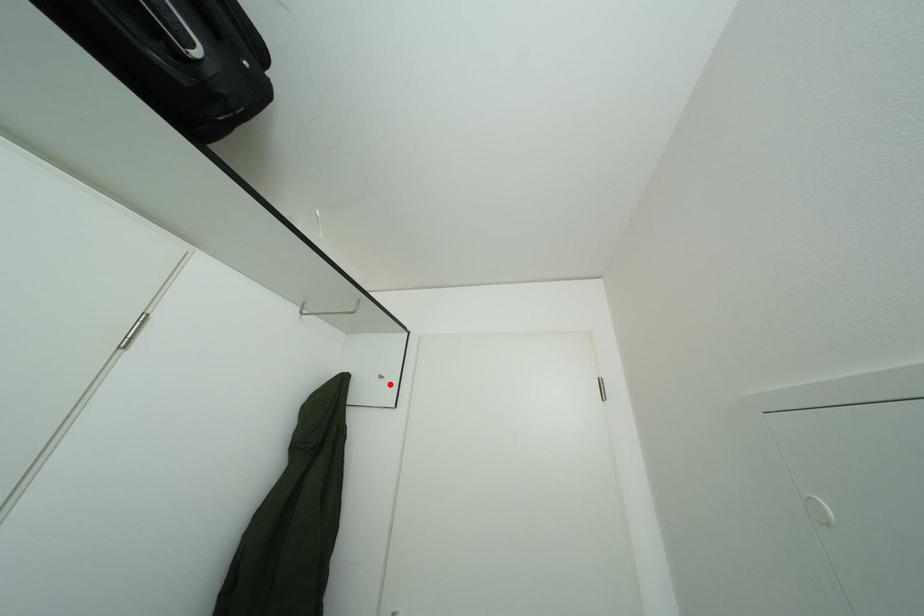
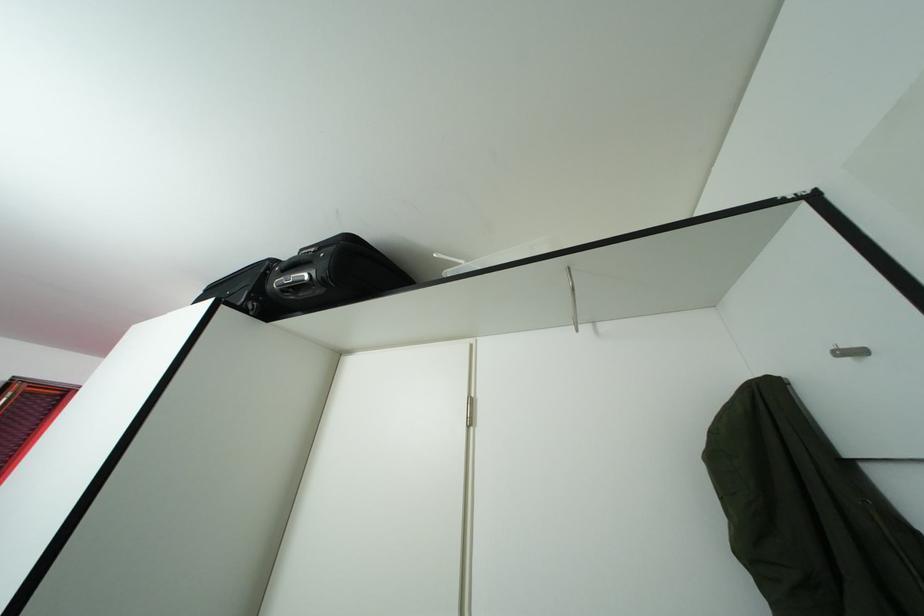
Find the pixel in the second image that matches the highlighted location in the first image.

(861, 360)